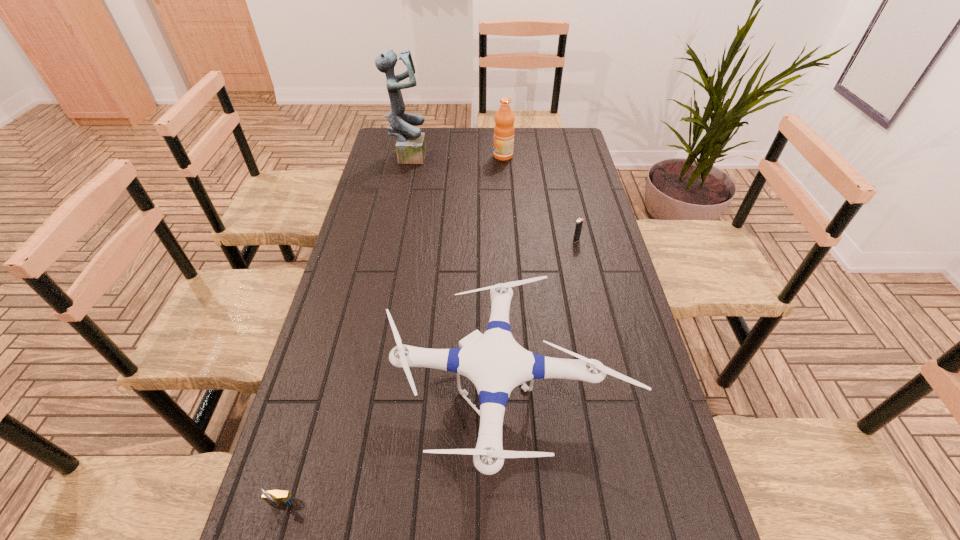
At what (x,y) coordinates should I click in order to perform the action: click on sculpture. Please return your answer as a coordinate pair (x, y). This screenshot has width=960, height=540. Looking at the image, I should click on (411, 146).

Image resolution: width=960 pixels, height=540 pixels. Find the location of `the fourth shortest object`. the fourth shortest object is located at coordinates (504, 119).

You are a GUI agent. You are given a task and a screenshot of the screen. Output one action in this format:
    pyautogui.click(x=<x>, y=<y>)
    Task: Click on the drone
    This screenshot has height=540, width=960.
    Given the screenshot: What is the action you would take?
    pyautogui.click(x=496, y=364)

This screenshot has width=960, height=540. Identify the location of igniter. (579, 223).

Find the location of `padlock`. padlock is located at coordinates (277, 498).

At what (x,y) coordinates should I click in order to perform the action: click on free space located 0.220m on the face of the sculpture. Please return your answer as a coordinate pair (x, y). The height and width of the screenshot is (540, 960). Looking at the image, I should click on (480, 155).

Identify the location of vacant space located on the label side of the fruit juice. The width and height of the screenshot is (960, 540). (x=402, y=156).

Where is `vacant space located 0.250m on the label side of the fruit juice`? This screenshot has height=540, width=960. vacant space located 0.250m on the label side of the fruit juice is located at coordinates (433, 156).

This screenshot has width=960, height=540. In order to click on vacant space situated on the label side of the fruit juice in this screenshot , I will do `click(421, 156)`.

You are a GUI agent. You are given a task and a screenshot of the screen. Output one action in this format:
    pyautogui.click(x=<x>, y=<y>)
    Task: Click on the free space located 0.210m on the back of the third shortest object
    This screenshot has height=540, width=960.
    Given the screenshot: What is the action you would take?
    pyautogui.click(x=501, y=262)